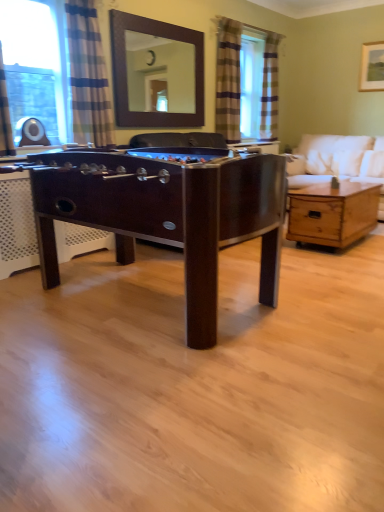
Question: Does blue striped curtain at left have a lesser width compared to white fabric couch at right?

Choices:
 (A) yes
 (B) no

Answer: (A)

Question: Is blue striped curtain at left in front of white fabric couch at right?

Choices:
 (A) yes
 (B) no

Answer: (A)

Question: From a real-world perspective, is blue striped curtain at left on top of white fabric couch at right?

Choices:
 (A) no
 (B) yes

Answer: (B)

Question: From the image's perspective, does blue striped curtain at left appear higher than white fabric couch at right?

Choices:
 (A) no
 (B) yes

Answer: (B)

Question: Is blue striped curtain at left not inside white fabric couch at right?

Choices:
 (A) no
 (B) yes

Answer: (B)

Question: Does blue striped curtain at left have a smaller size compared to white fabric couch at right?

Choices:
 (A) yes
 (B) no

Answer: (A)

Question: Is white fabric couch at right far from brown wooden mirror at upper center?

Choices:
 (A) no
 (B) yes

Answer: (B)

Question: From the image's perspective, is white fabric couch at right located beneath brown wooden mirror at upper center?

Choices:
 (A) no
 (B) yes

Answer: (B)

Question: From a real-world perspective, is white fabric couch at right over brown wooden mirror at upper center?

Choices:
 (A) yes
 (B) no

Answer: (B)

Question: Can you confirm if white fabric couch at right is shorter than brown wooden mirror at upper center?

Choices:
 (A) no
 (B) yes

Answer: (A)

Question: Is white fabric couch at right to the right of brown wooden mirror at upper center from the viewer's perspective?

Choices:
 (A) no
 (B) yes

Answer: (B)

Question: From a real-world perspective, is white fabric couch at right under brown wooden mirror at upper center?

Choices:
 (A) no
 (B) yes

Answer: (B)

Question: From the image's perspective, is white fabric couch at right located beneath wooden coffee table at center?

Choices:
 (A) no
 (B) yes

Answer: (A)